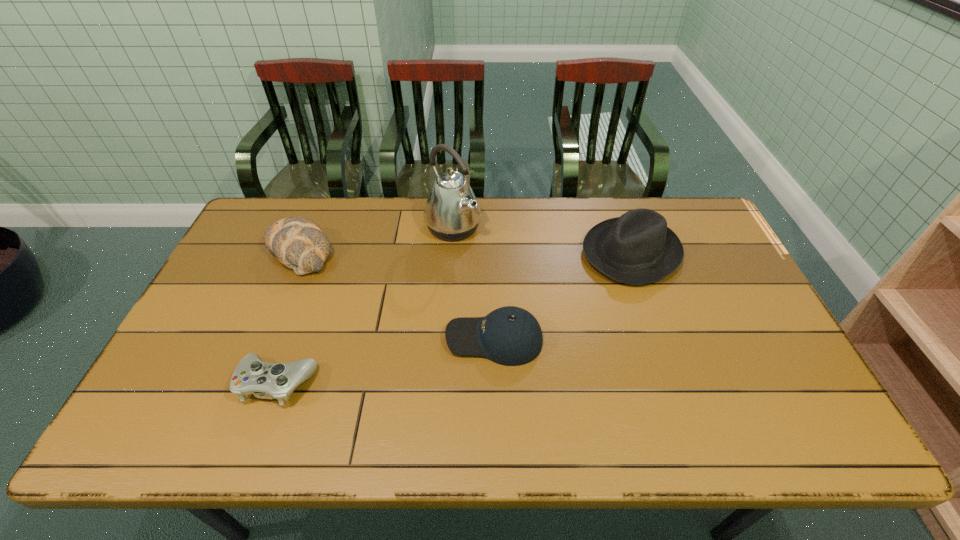
Locate an element on the screen. kettle is located at coordinates (452, 212).

The height and width of the screenshot is (540, 960). I want to click on the fourth shortest object, so click(x=637, y=248).

Image resolution: width=960 pixels, height=540 pixels. Find the location of `fedora`. fedora is located at coordinates (637, 248).

Locate an element on the screen. The height and width of the screenshot is (540, 960). bread is located at coordinates (298, 243).

Where is `baseball cap`? The image size is (960, 540). baseball cap is located at coordinates (511, 336).

You are a GUI agent. You are given a task and a screenshot of the screen. Output one action in this format:
    pyautogui.click(x=<x>, y=<y>)
    Task: Click on the shortest object
    
    Given the screenshot: What is the action you would take?
    pyautogui.click(x=265, y=380)

Image resolution: width=960 pixels, height=540 pixels. Identify the location of free region located 0.050m on the front of the kettle. (451, 256).

I want to click on free point located on the right of the fedora, so click(x=706, y=253).

Identify the location of free point located on the right of the bread. (453, 252).

I want to click on vacant space situated 0.230m on the front-facing side of the baseball cap, so click(x=360, y=339).